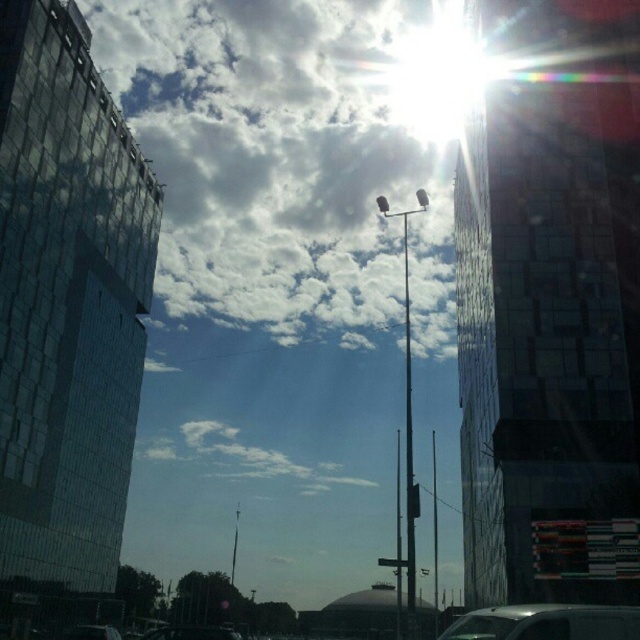
Between metallic silver van at center and metallic traffic light at center, which one is positioned lower?

metallic silver van at center is lower down.

Which is behind, point (477, 636) or point (419, 490)?

Point (419, 490)

At what (x,y) coordinates should I click in order to perform the action: click on metallic silver van at center. Please return your answer as a coordinate pair (x, y). Image resolution: width=640 pixels, height=640 pixels. Looking at the image, I should click on (547, 621).

Can you confirm if white matte car at lower center is shorter than metallic traffic light at center?

In fact, white matte car at lower center may be taller than metallic traffic light at center.

Is point (188, 634) behind point (412, 502)?

No, (188, 634) is closer to viewer.

I want to click on white matte car at lower center, so [192, 632].

At what (x,y) coordinates should I click in order to perform the action: click on white matte car at lower center. Please return your answer as a coordinate pair (x, y). The width and height of the screenshot is (640, 640). Looking at the image, I should click on (192, 632).

Is point (269, 282) less distant than point (410, 488)?

No, it is not.

Can you confirm if white fluffy cloud at upper center is positioned below metallic traffic light at center?

Incorrect, white fluffy cloud at upper center is not positioned below metallic traffic light at center.

Who is more distant from viewer, (349, 198) or (410, 486)?

The point (349, 198) is behind.

What are the coordinates of `white fluffy cloud at upper center` in the screenshot? It's located at (289, 157).